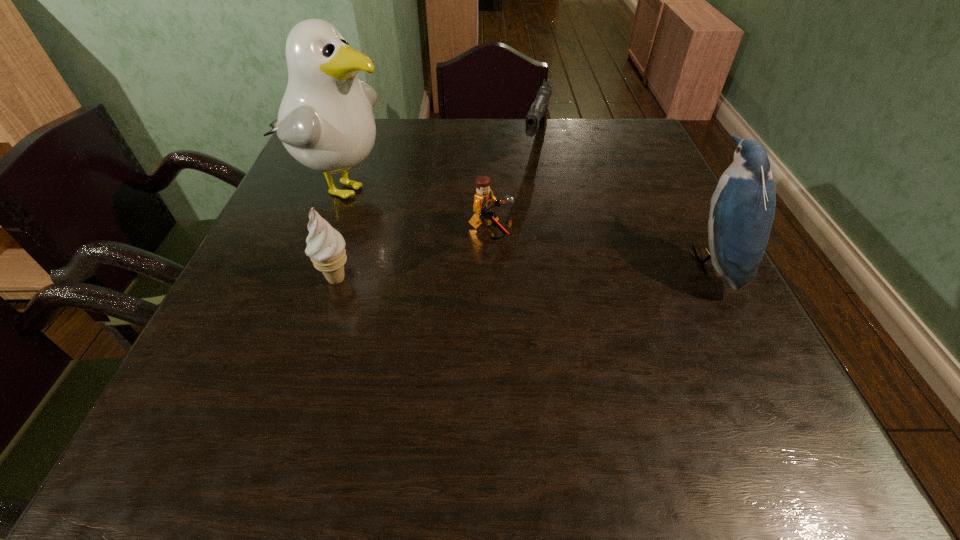
I want to click on gull situated at the far edge, so click(x=325, y=121).

Where is `icecream situated at the left edge`? This screenshot has height=540, width=960. icecream situated at the left edge is located at coordinates (325, 246).

Find the location of a particular element. The width and height of the screenshot is (960, 540). gull that is at the left edge is located at coordinates (325, 121).

At what (x,y) coordinates should I click in order to perform the action: click on object positioned at the right edge. Please return your answer as a coordinate pair (x, y). The height and width of the screenshot is (540, 960). Looking at the image, I should click on (742, 211).

Where is `object present at the far left corner`? Image resolution: width=960 pixels, height=540 pixels. object present at the far left corner is located at coordinates (325, 121).

The height and width of the screenshot is (540, 960). Find the location of `blank area at the far edge`. blank area at the far edge is located at coordinates (389, 119).

Identify the location of free region at the near edge of the desktop. This screenshot has width=960, height=540. (609, 363).

In the image, there is a desktop. At what (x,y) coordinates should I click in order to perform the action: click on vacant space at the left edge. Please return your answer as a coordinate pair (x, y). The image size is (960, 540). Looking at the image, I should click on (293, 260).

In the image, there is a desktop. At what (x,y) coordinates should I click in order to perform the action: click on free space at the right edge. Please return your answer as a coordinate pair (x, y). The image size is (960, 540). Looking at the image, I should click on (727, 301).

Where is `vacant region at the far right corner of the desktop`? This screenshot has width=960, height=540. vacant region at the far right corner of the desktop is located at coordinates (605, 154).